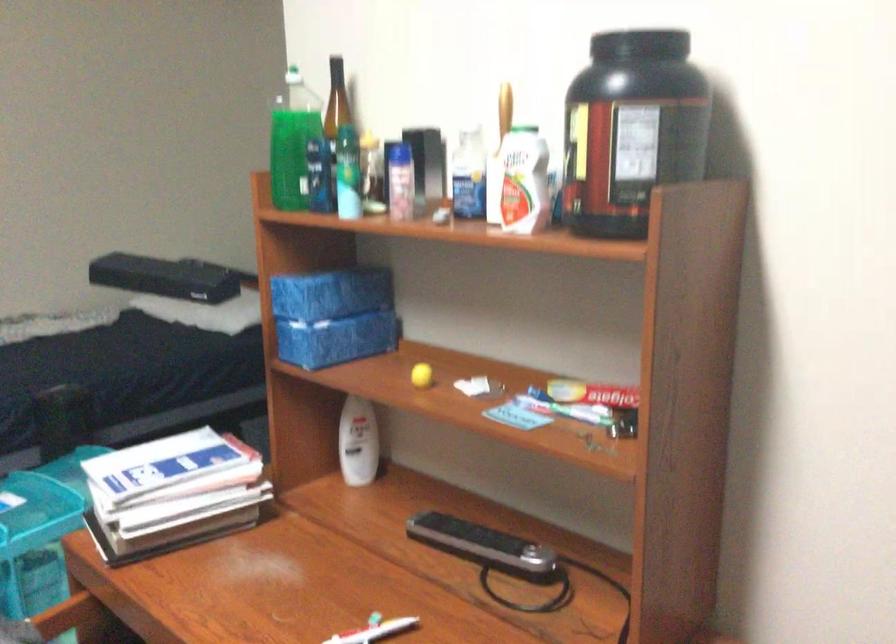
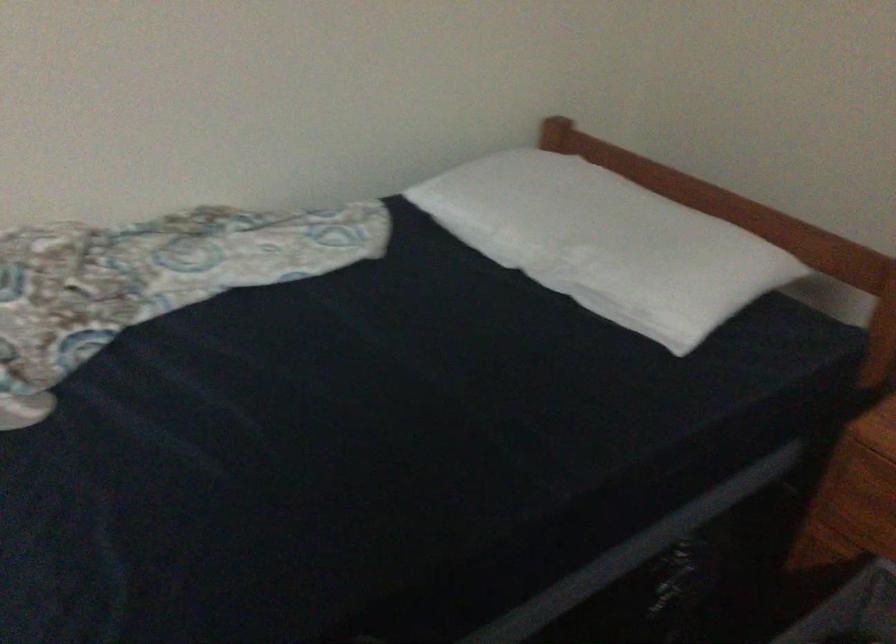
The images are taken continuously from a first-person perspective. In which direction are you moving?

The cameraman walked toward left, forward.